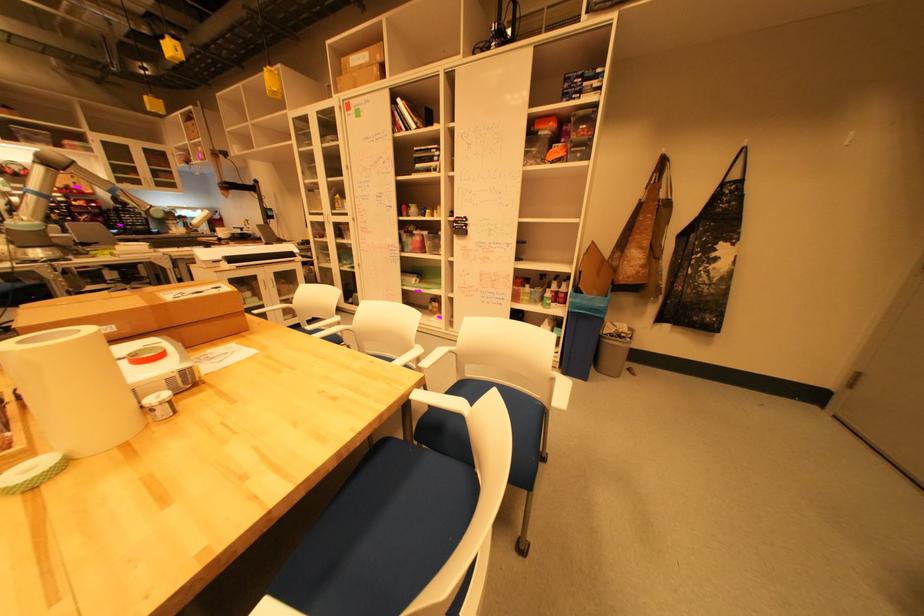
Image resolution: width=924 pixels, height=616 pixels. Describe the element at coordinates (155, 368) in the screenshot. I see `the white projector` at that location.